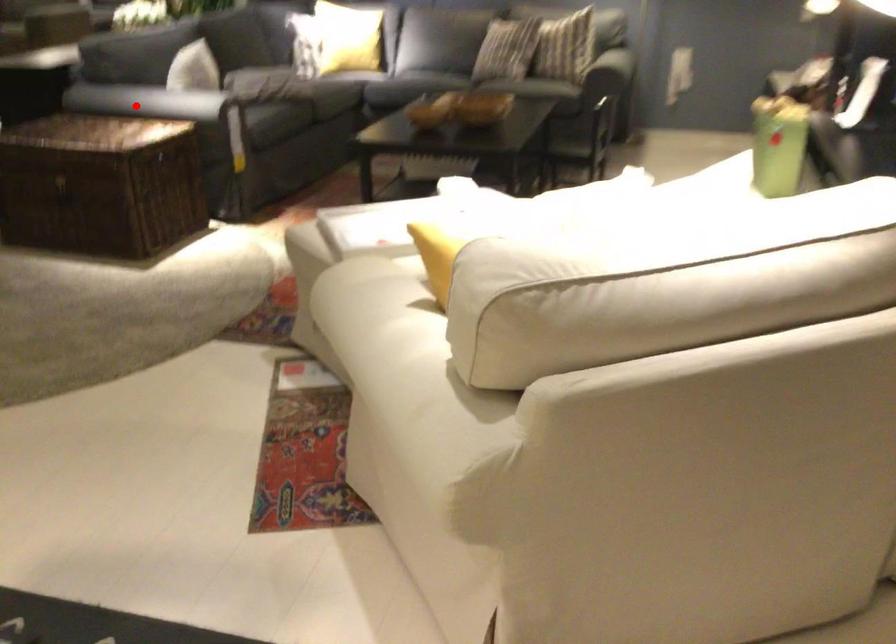
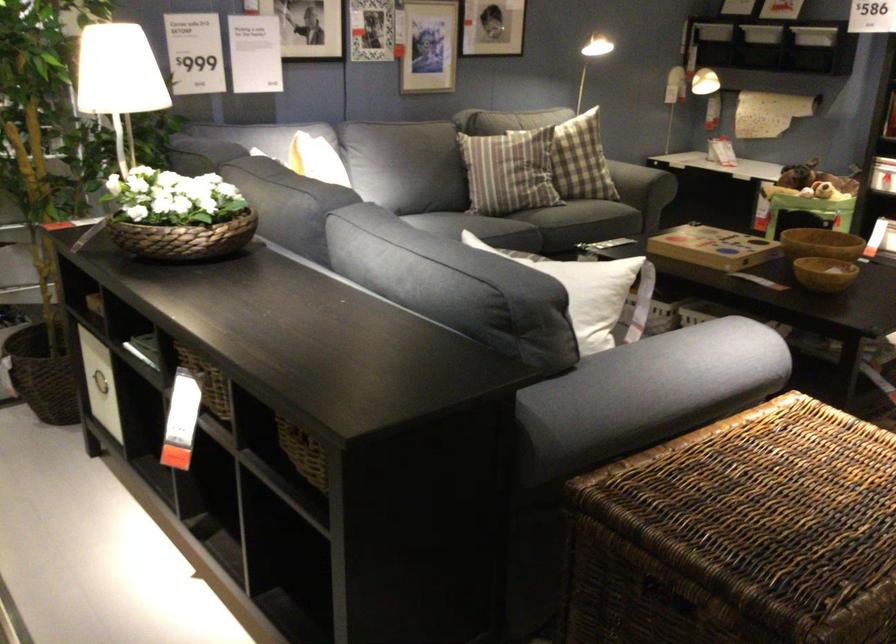
In the second image, find the point that corresponds to the highlighted location in the first image.

(647, 393)